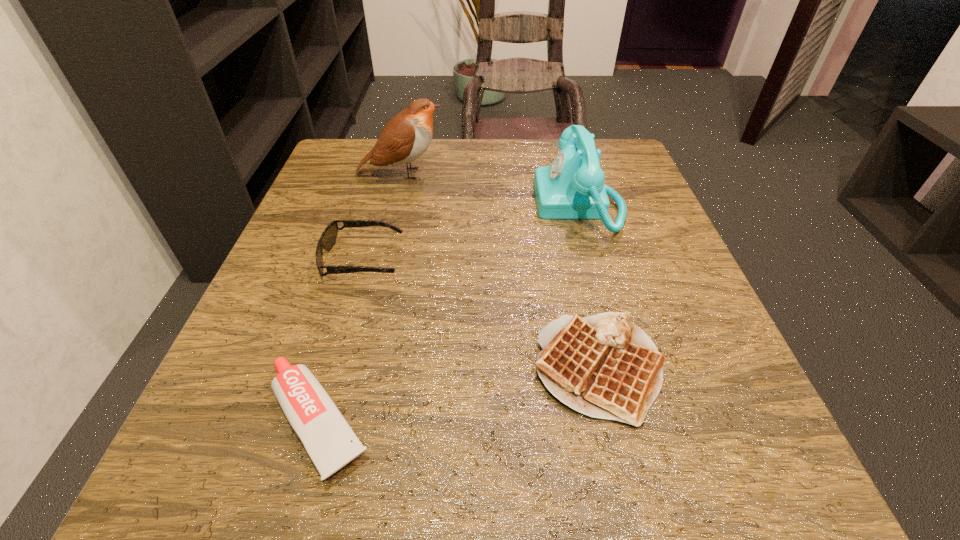
You are a GUI agent. You are given a task and a screenshot of the screen. Output one action in this format:
    pyautogui.click(x=<x>, y=<y>)
    Task: Click on the blank region between the tallest object and the waffle
    This screenshot has height=540, width=960.
    Given the screenshot: What is the action you would take?
    pyautogui.click(x=500, y=271)

Identify the location of empty space that is in between the sunglasses and the bird. (382, 217).

Identify the location of empty space between the waffle and the tallest object. (500, 271).

Locate an element on the screen. The width and height of the screenshot is (960, 540). vacant space that's between the tallest object and the telephone is located at coordinates (491, 189).

At what (x,y) coordinates should I click in order to perform the action: click on empty space between the tallest object and the telephone. Please return your answer as a coordinate pair (x, y). Looking at the image, I should click on (491, 189).

Find the location of a particular element. blank region between the sunglasses and the waffle is located at coordinates 481,314.

What are the coordinates of `free spot between the waffle and the telephone` in the screenshot? It's located at (588, 286).

Image resolution: width=960 pixels, height=540 pixels. Find the location of `vacant region between the waffle and the bird`. vacant region between the waffle and the bird is located at coordinates (500, 271).

Where is `vacant space in between the toothpaste and the bird`? This screenshot has height=540, width=960. vacant space in between the toothpaste and the bird is located at coordinates (360, 297).

Locate an element on the screen. The width and height of the screenshot is (960, 540). the second closest object to the sunglasses is located at coordinates (405, 138).